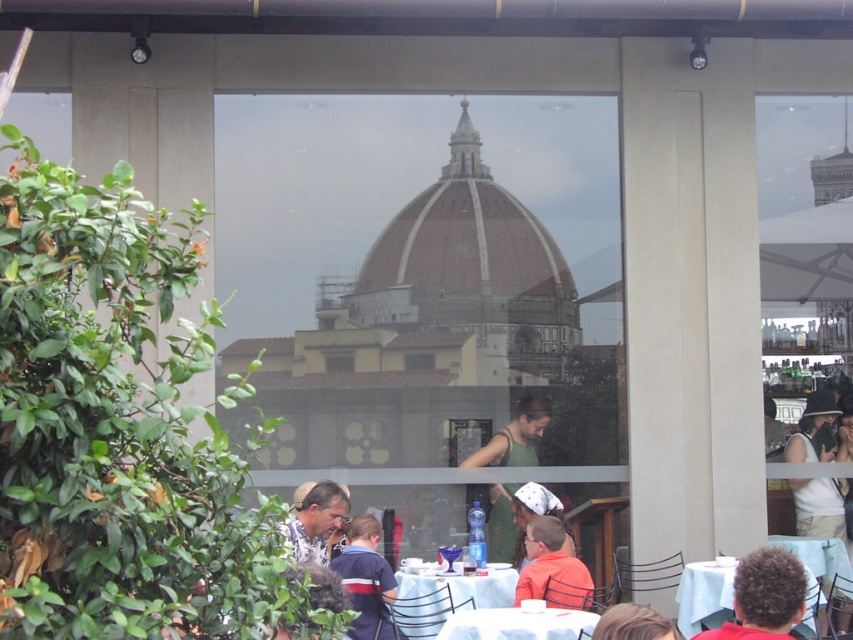
Is white tablecloth at lower right bigger than green fabric dress at center?

No.

Is white tablecloth at lower right shorter than green fabric dress at center?

Yes.

Who is more forward, (799,568) or (515,484)?

Positioned in front is point (799,568).

Locate an element on the screen. white tablecloth at lower right is located at coordinates (764, 596).

Does matte white tank top at center have a greater height compared to white glossy table at lower center?

Indeed, matte white tank top at center has a greater height compared to white glossy table at lower center.

Does matte white tank top at center have a lesser height compared to white glossy table at lower center?

Incorrect, matte white tank top at center's height does not fall short of white glossy table at lower center's.

Identify the location of matte white tank top at center. This screenshot has height=640, width=853. (819, 433).

Is green fabric dress at center thinner than matte white shirt at lower center?

Incorrect, green fabric dress at center's width is not less than matte white shirt at lower center's.

Based on the photo, can you confirm if green fabric dress at center is smaller than matte white shirt at lower center?

No, green fabric dress at center is not smaller than matte white shirt at lower center.

Which is behind, point (502, 548) or point (321, 545)?

The point (502, 548) is more distant.

Identify the location of green fabric dress at center. The height and width of the screenshot is (640, 853). (514, 436).